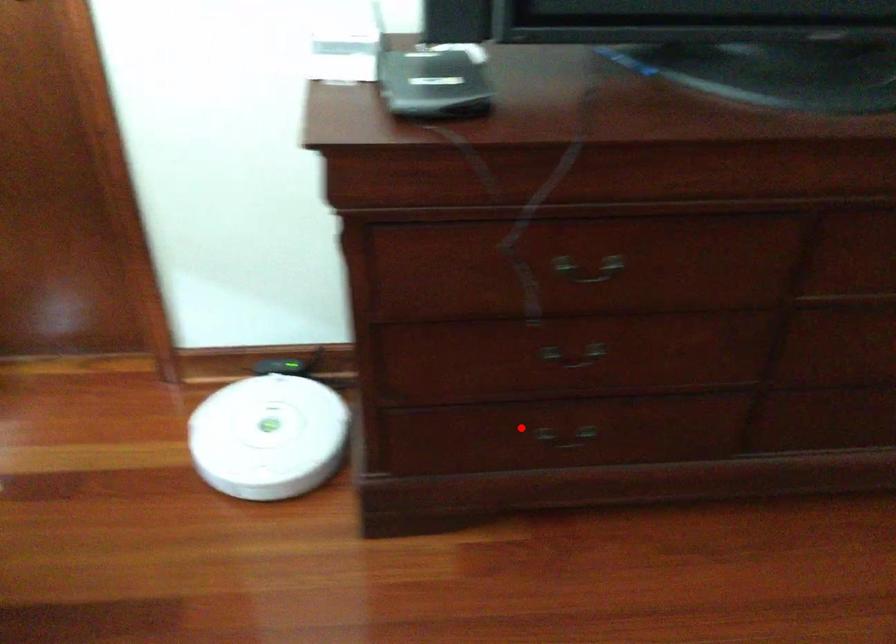
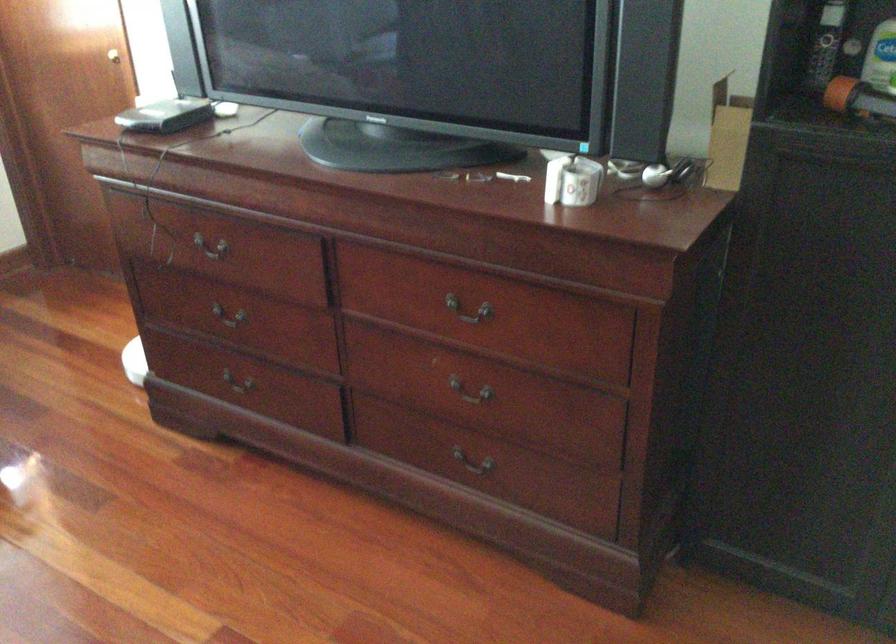
Locate, in the second image, the point that corresponds to the highlighted location in the first image.

(236, 391)